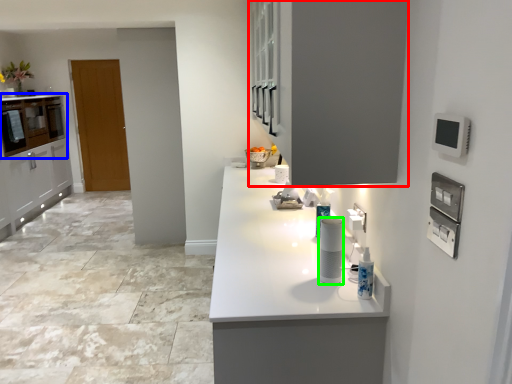
Question: Which is nearer to the cabinetry (highlighted by a red box)? cabinetry (highlighted by a blue box) or appliance (highlighted by a green box).

Choices:
 (A) cabinetry
 (B) appliance

Answer: (B)